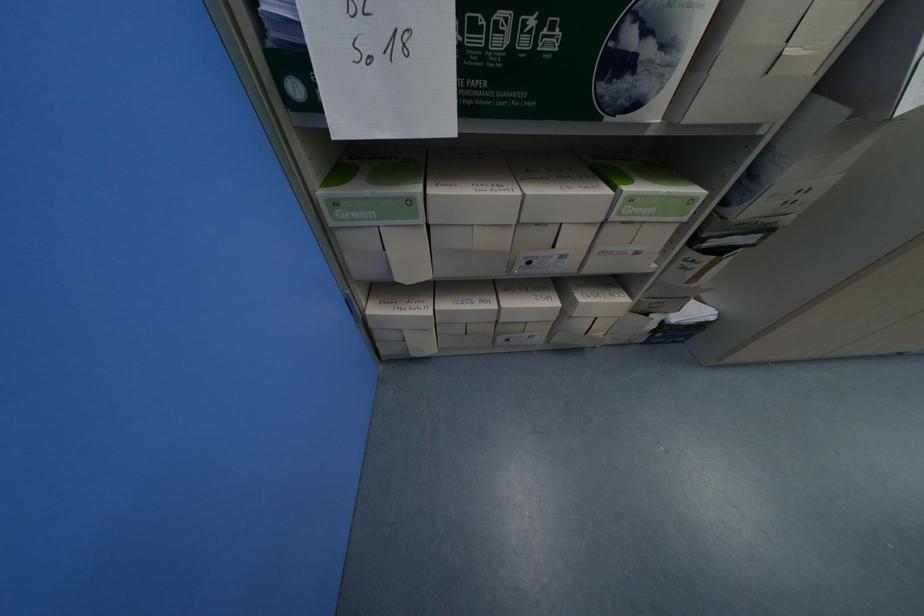
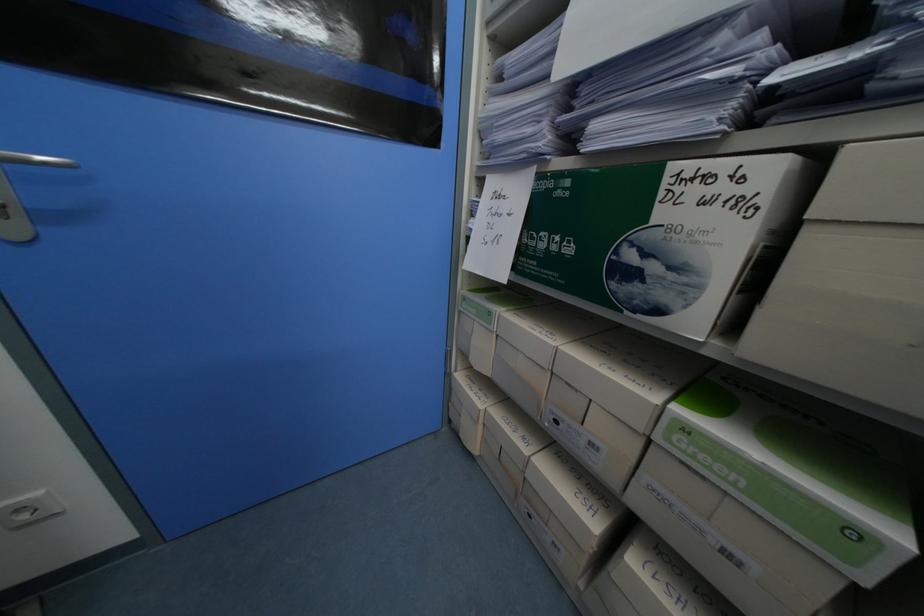
Question: How did the camera likely rotate?

Choices:
 (A) Left
 (B) Right
 (C) Up
 (D) Down

Answer: (A)